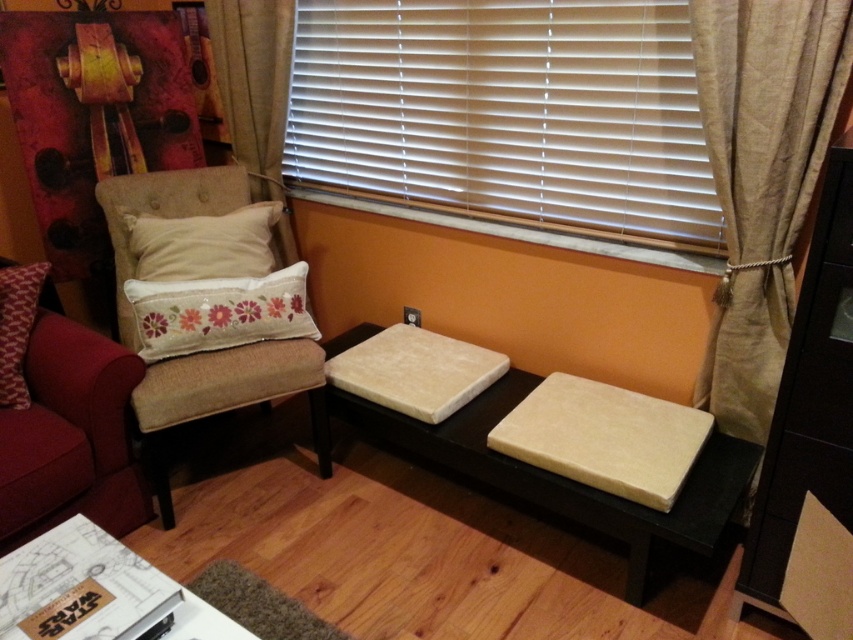
You are planning to open the window in this room. To do so, you need to move the white plastic blinds at upper center and the beige fabric curtain at right. Which object should you move first to access the window?

You should move the white plastic blinds at upper center first because it is positioned over the beige fabric curtain at right, meaning it is closer to the window and must be moved before the curtain.

You are sitting on the beige fabric armchair at left and want to adjust the white plastic blinds at upper center to let in more light. Can you reach them from your current position?

The white plastic blinds at upper center is positioned over beige fabric armchair at left, so yes, you can reach them from your current position on the beige fabric armchair at left since they are directly above you.

You are organizing a small gathering and need to arrange seating. You have two pillows to place on the beige armchair. The beige fabric pillow at upper left and the red textured pillow at left. Which pillow should you place at the back of the armchair for better support, and why?

The beige fabric pillow at upper left should be placed at the back of the armchair because it is larger in size than the red textured pillow at left, providing better support.